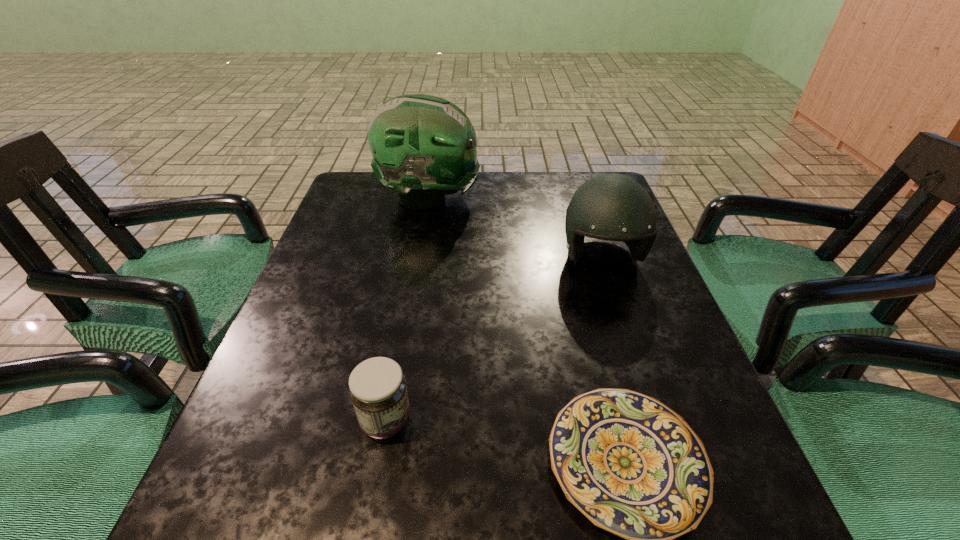
This screenshot has width=960, height=540. Find the location of `the tallest object`. the tallest object is located at coordinates (423, 147).

Find the location of `the taller football helmet`. the taller football helmet is located at coordinates (423, 147).

Where is `the right football helmet`? the right football helmet is located at coordinates (614, 207).

You are a GUI agent. You are given a task and a screenshot of the screen. Output one action in this format:
    pyautogui.click(x=<x>, y=<y>)
    Task: Click on the nearer football helmet
    The width and height of the screenshot is (960, 540).
    Given the screenshot: What is the action you would take?
    pyautogui.click(x=614, y=207)

Find the location of `jam`. jam is located at coordinates (378, 391).

Locate an element on the screen. This screenshot has width=960, height=540. free location located on the visor of the tallest object is located at coordinates (578, 198).

The width and height of the screenshot is (960, 540). Find the location of `blank space located 0.310m at the face opening of the shorter football helmet`. blank space located 0.310m at the face opening of the shorter football helmet is located at coordinates (653, 414).

Locate an element on the screen. This screenshot has height=540, width=960. vacant space positioned on the front label of the second shortest object is located at coordinates (545, 421).

I want to click on object at the far edge, so click(x=423, y=147).

Where is `object that is at the left edge`? object that is at the left edge is located at coordinates (423, 147).